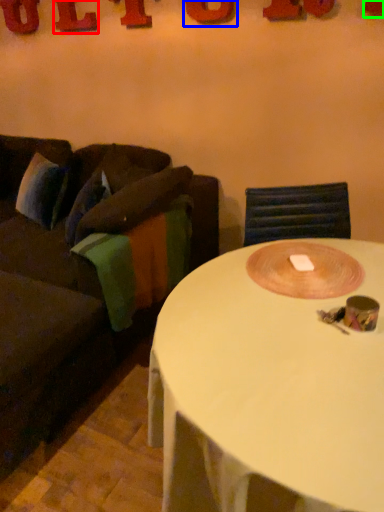
Question: Which object is the closest to the letter (highlighted by a red box)? Choose among these: letter (highlighted by a blue box) or letter (highlighted by a green box).

Choices:
 (A) letter
 (B) letter

Answer: (A)